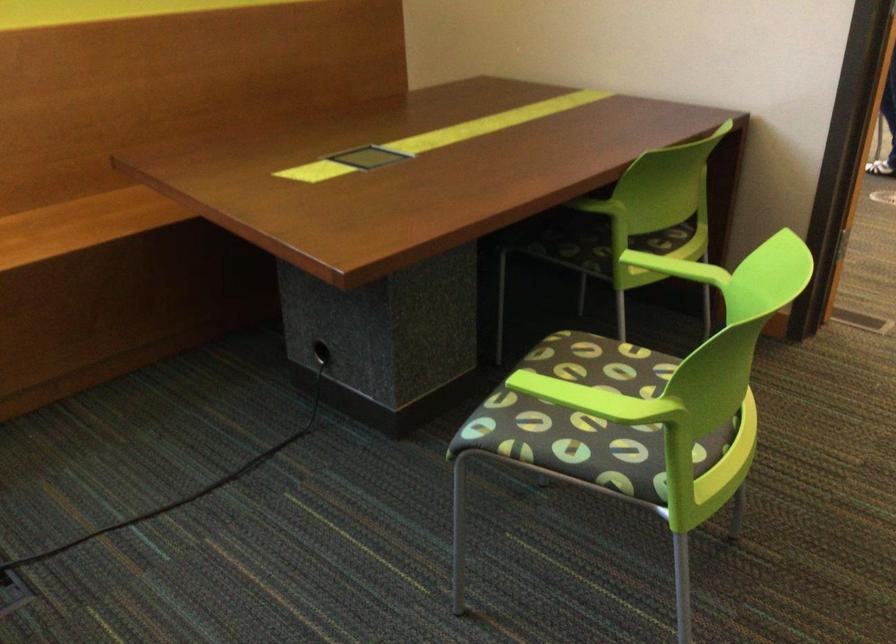
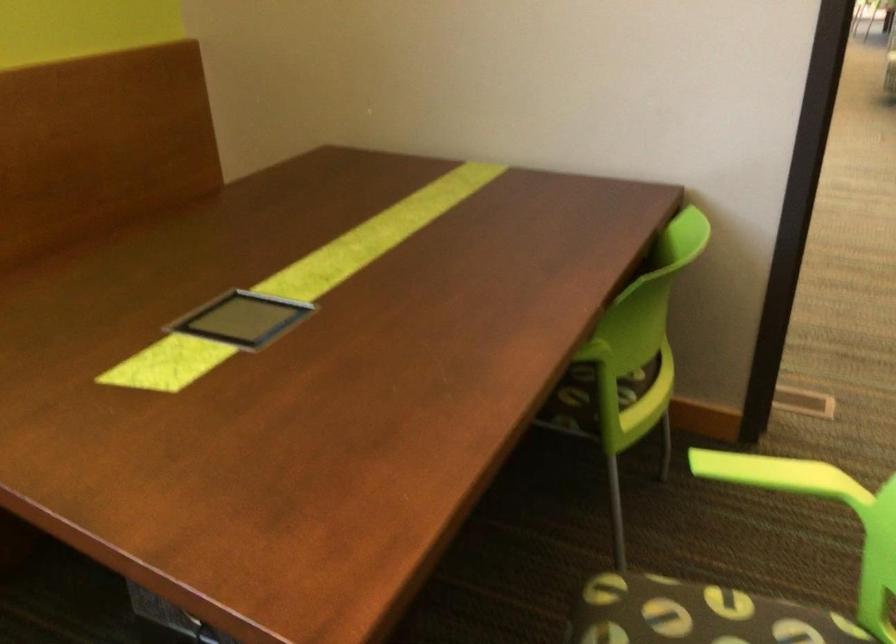
Question: The camera is either moving clockwise (left) or counter-clockwise (right) around the object. The first image is from the beginning of the video and the second image is from the end. Is the camera moving left or right when shooting the video?

Choices:
 (A) Left
 (B) Right

Answer: (A)